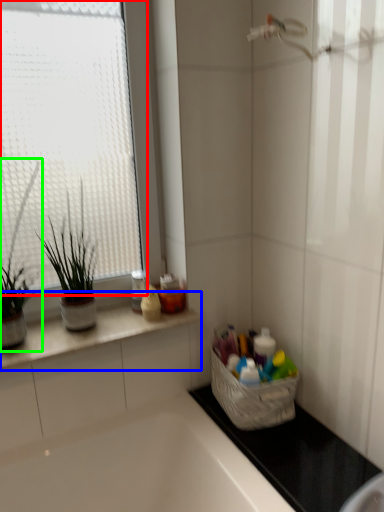
Question: Which object is positioned closest to window (highlighted by a red box)? Select from countertop (highlighted by a blue box) and houseplant (highlighted by a green box).

Choices:
 (A) countertop
 (B) houseplant

Answer: (B)